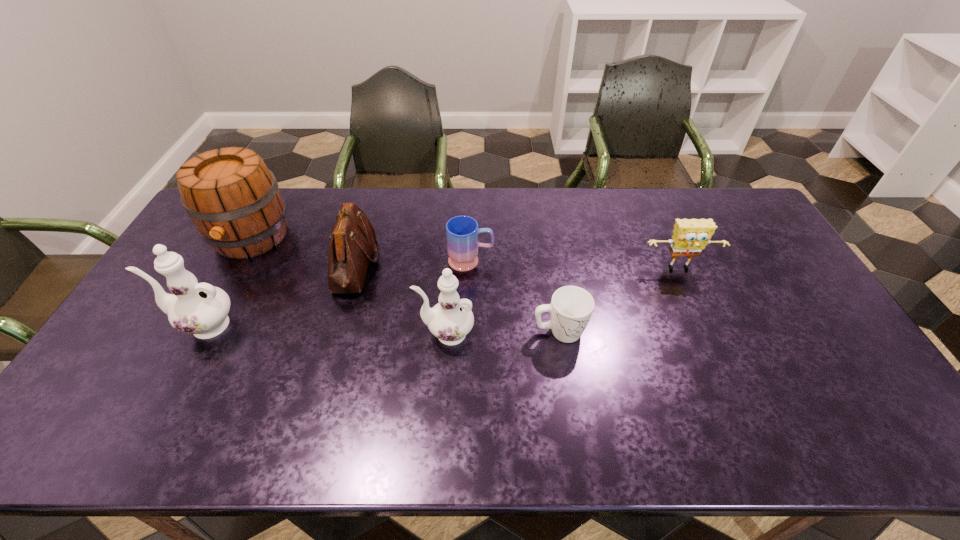
Identify the location of object that is at the far edge. The width and height of the screenshot is (960, 540). (233, 199).

This screenshot has height=540, width=960. Find the location of `chinaware that is at the left edge`. chinaware that is at the left edge is located at coordinates (201, 309).

Where is `cider that is at the left edge`? cider that is at the left edge is located at coordinates (233, 199).

The width and height of the screenshot is (960, 540). Identify the location of object that is at the far left corner. (233, 199).

In the image, there is a desktop. Where is `free space at the far edge`? This screenshot has height=540, width=960. free space at the far edge is located at coordinates (571, 193).

In the image, there is a desktop. At what (x,y) coordinates should I click in order to perform the action: click on free space at the near edge. Please return your answer as a coordinate pair (x, y). Looking at the image, I should click on (580, 380).

In the image, there is a desktop. In order to click on vacant area at the left edge in this screenshot , I will do `click(217, 256)`.

Where is `free spot at the right edge of the desktop`? The height and width of the screenshot is (540, 960). free spot at the right edge of the desktop is located at coordinates click(x=752, y=253).

In the image, there is a desktop. In order to click on vacant space at the far right corner in this screenshot , I will do `click(736, 223)`.

Find the location of a particular element. This screenshot has height=540, width=960. vacant space at the near right corner of the desktop is located at coordinates (822, 397).